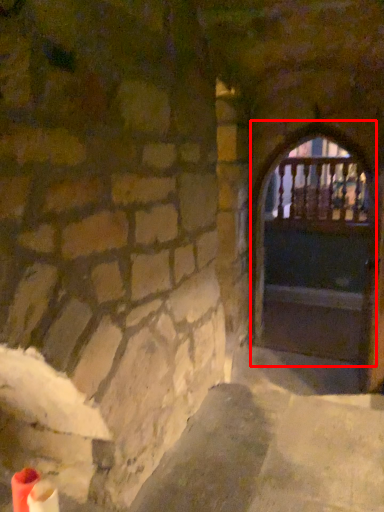
Question: From the image's perspective, what is the correct spatial positioning of door (annotated by the red box) in reference to window?

Choices:
 (A) below
 (B) above

Answer: (A)